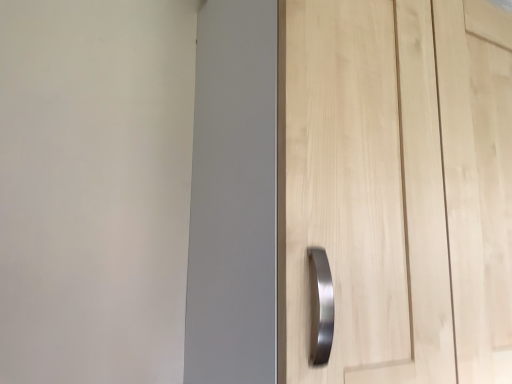
This screenshot has width=512, height=384. What do you see at coordinates (401, 188) in the screenshot?
I see `light wood cupboard handle at center` at bounding box center [401, 188].

Find the location of `light wood cupboard handle at center`. light wood cupboard handle at center is located at coordinates (401, 188).

At what (x,y) coordinates should I click in order to perform the action: click on light wood cupboard handle at center. Please return your answer as a coordinate pair (x, y). Looking at the image, I should click on (401, 188).